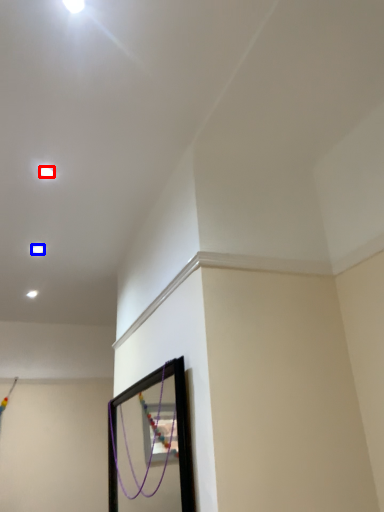
Question: Which object is closer to the camera taking this photo, light (highlighted by a red box) or light (highlighted by a blue box)?

Choices:
 (A) light
 (B) light

Answer: (A)